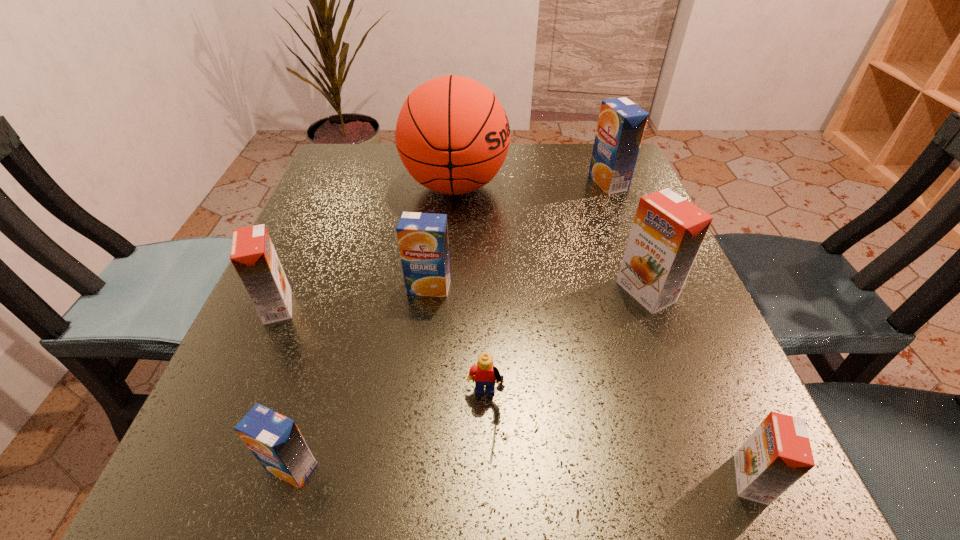
This screenshot has width=960, height=540. I want to click on the nearest blue orange_juice, so click(x=275, y=440).

Identify the location of the leftmost blue orange_juice. This screenshot has width=960, height=540. (275, 440).

You are a GUI agent. You are given a task and a screenshot of the screen. Output one action in this format:
    pyautogui.click(x=<x>, y=<y>)
    Task: Click on the smallest orange orange juice
    This screenshot has height=540, width=960.
    Given the screenshot: What is the action you would take?
    pyautogui.click(x=778, y=453)

The width and height of the screenshot is (960, 540). I want to click on blank area located on the side with logo of the basketball, so click(642, 186).

Where is `free space located 0.120m on the left of the farthest orange juice`? The image size is (960, 540). free space located 0.120m on the left of the farthest orange juice is located at coordinates (539, 183).

Locate an element on the screen. This screenshot has height=540, width=960. vacant area situated 0.150m on the back of the biggest orange orange juice is located at coordinates (619, 222).

What are the coordinates of `free space located 0.290m on the front of the second biggest orange orange juice` in the screenshot? It's located at (183, 518).

I want to click on free space located on the right of the second blue orange_juice from right to left, so click(558, 287).

Locate an element on the screen. This screenshot has height=540, width=960. free space located on the front-facing side of the yellow Lego is located at coordinates (487, 503).

The width and height of the screenshot is (960, 540). Identify the location of free region located on the back of the second orange juice from left to right. (346, 292).